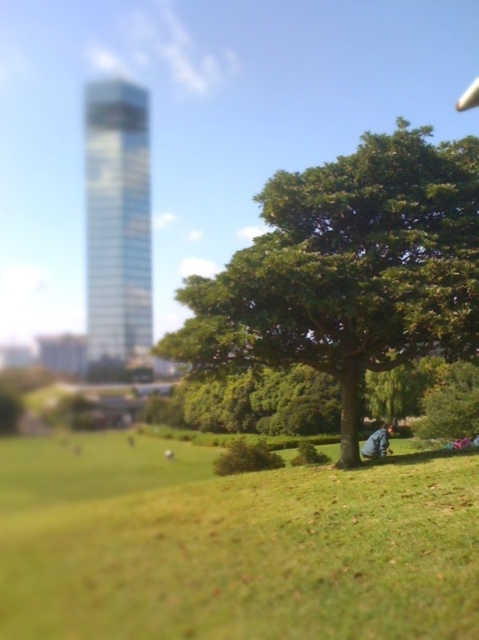
Does green leafy tree at center appear over blue denim jeans at lower right?

Correct, green leafy tree at center is located above blue denim jeans at lower right.

Find the location of a particular element. The image size is (479, 640). green leafy tree at center is located at coordinates (349, 269).

Locate an element on the screen. This screenshot has height=640, width=479. green leafy tree at center is located at coordinates click(349, 269).

Who is shorter, green grassy field at lower center or green leafy tree at center?

With less height is green grassy field at lower center.

Based on the photo, who is positioned more to the left, green grassy field at lower center or green leafy tree at center?

From the viewer's perspective, green grassy field at lower center appears more on the left side.

Which is behind, point (132, 589) or point (455, 353)?

The point (455, 353) is behind.

Image resolution: width=479 pixels, height=640 pixels. I want to click on green grassy field at lower center, so click(x=232, y=545).

The height and width of the screenshot is (640, 479). I want to click on green grassy field at lower center, so click(232, 545).

Image resolution: width=479 pixels, height=640 pixels. Identify the location of green grassy field at lower center. (232, 545).